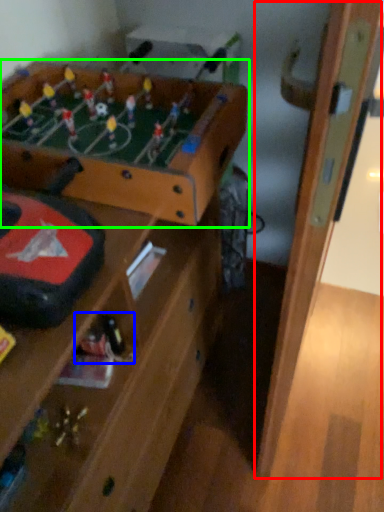
Question: Estimate the real-world distances between objects in this image. Which object is closer to door (highlighted by a red box), toy (highlighted by a blue box) or table (highlighted by a green box)?

Choices:
 (A) toy
 (B) table

Answer: (B)